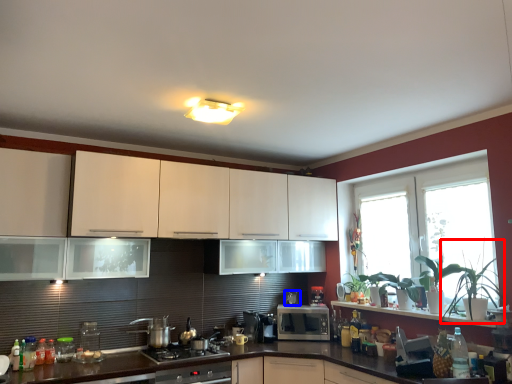
Question: Which point is further to the camera, plant (highlighted by a red box) or appliance (highlighted by a blue box)?

Choices:
 (A) plant
 (B) appliance

Answer: (B)